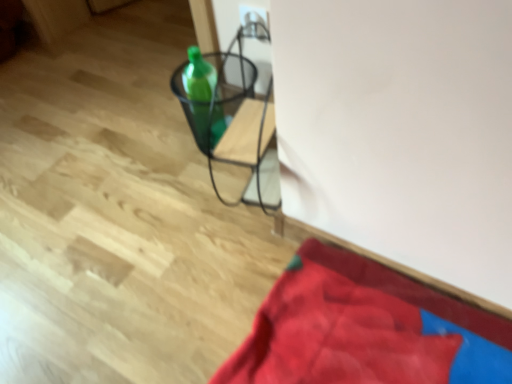
Question: From the image's perspective, is metallic wire basket at center positioned above or below green glass bottle at center?

Choices:
 (A) below
 (B) above

Answer: (A)

Question: In terms of size, does metallic wire basket at center appear bigger or smaller than green glass bottle at center?

Choices:
 (A) small
 (B) big

Answer: (B)

Question: Considering the real-world distances, which object is farthest from the velvety red blanket at lower right?

Choices:
 (A) green glass bottle at center
 (B) metallic wire basket at center

Answer: (A)

Question: Which object is the farthest from the green glass bottle at center?

Choices:
 (A) velvety red blanket at lower right
 (B) metallic wire basket at center

Answer: (A)